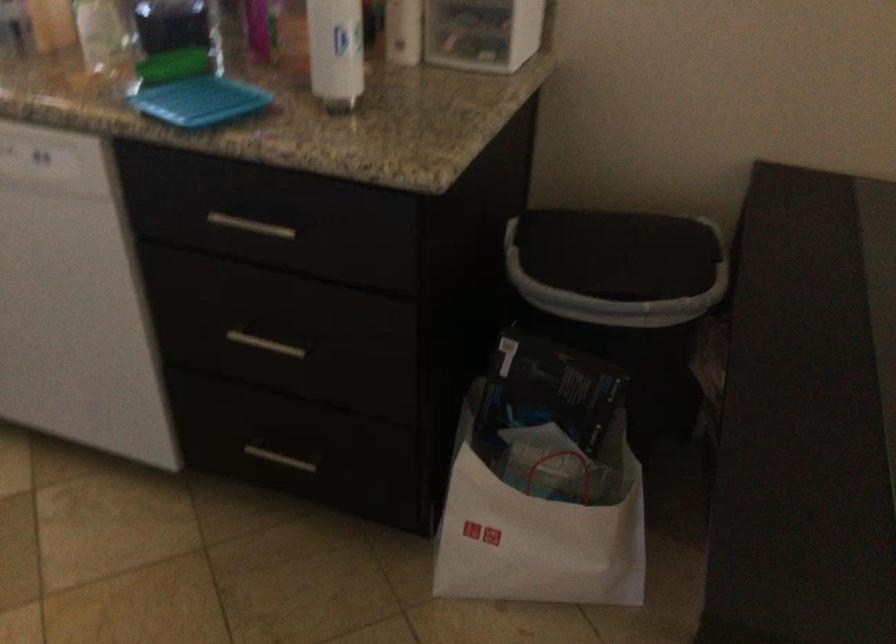
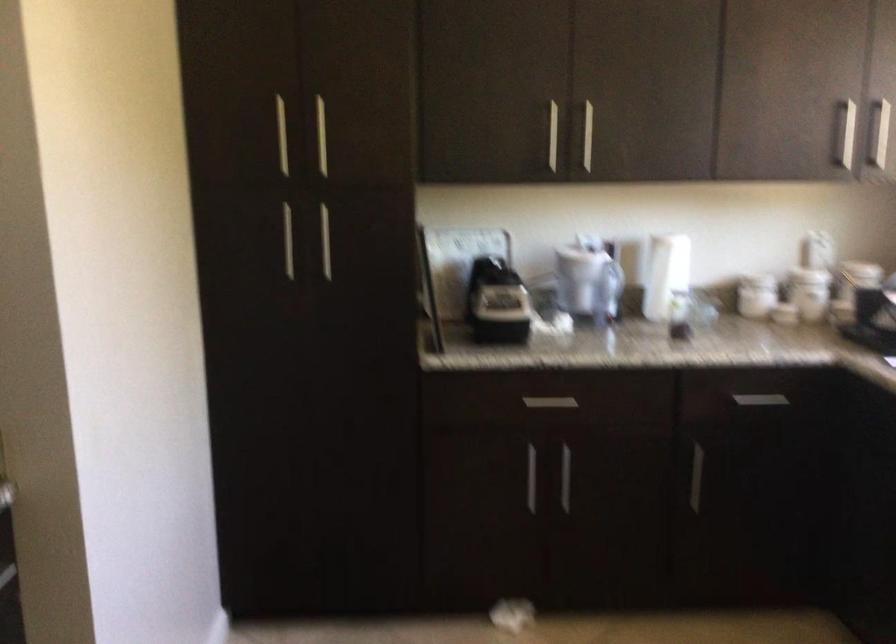
Question: The first image is from the beginning of the video and the second image is from the end. How did the camera likely rotate when shooting the video?

Choices:
 (A) Left
 (B) Right
 (C) Up
 (D) Down

Answer: (A)